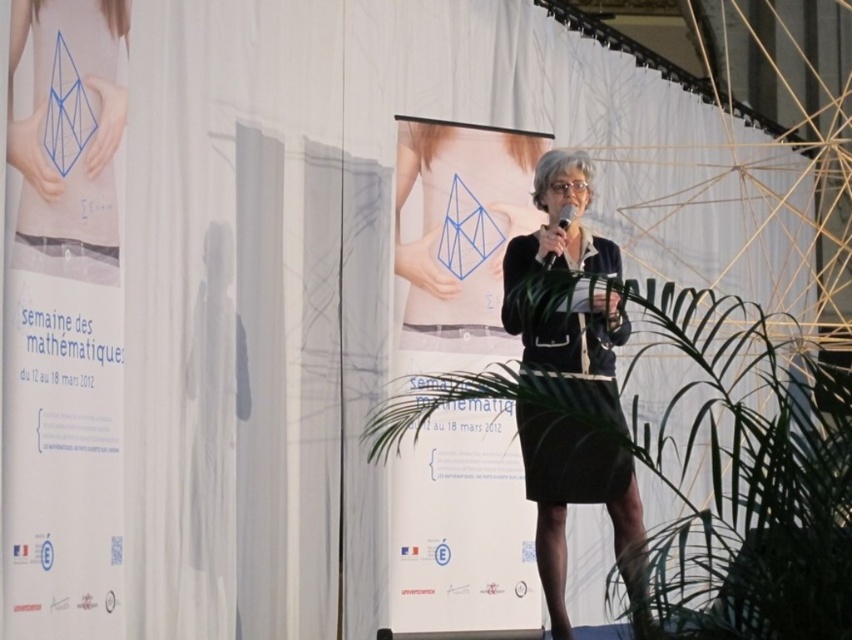
Consider the image. You are a photographer standing in front of the podium. You want to capture a photo of the woman speaking while ensuring her skirt is centered in the frame. Given the coordinates of the skirt as point (x=584, y=296), where should you position your camera to center the skirt?

To center the skirt at point (x=584, y=296) in the frame, position the camera so that the center of the viewfinder aligns with the coordinates (x=584, y=296). This ensures the black fabric skirt at center is perfectly centered in the photo.

You are an attendee at the event and need to locate the speaker. Where is the black fabric skirt at center located in the image?

The black fabric skirt at center is located at point 0.463 on the x axis and 0.687 on the y axis.